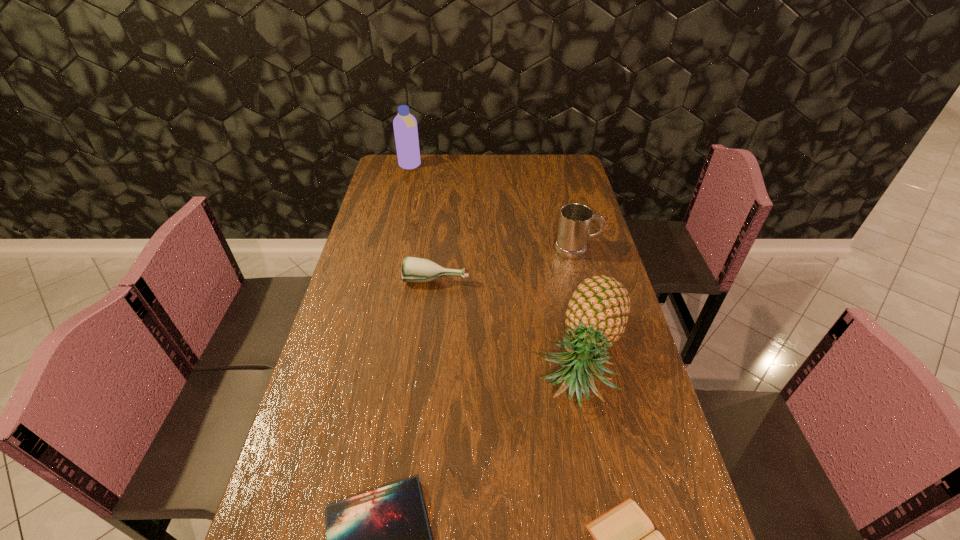
Locate an element on the screen. vacant area that lies between the fourth tallest object and the tallest object is located at coordinates coord(423,222).

Locate which object is the fourth closest to the third farthest object. Please provide its 2D coordinates. Your answer should be formatted as a tuple, i.e. [(x, y)], where the tuple contains the x and y coordinates of a point satisfying the conditions above.

[(405, 125)]

Image resolution: width=960 pixels, height=540 pixels. I want to click on object that is the fifth nearest to the farthest object, so click(x=624, y=538).

The width and height of the screenshot is (960, 540). I want to click on free location that satisfies the following two spatial constraints: 1. on the front side of the third shortest object; 2. on the left side of the tallest object, so click(x=384, y=279).